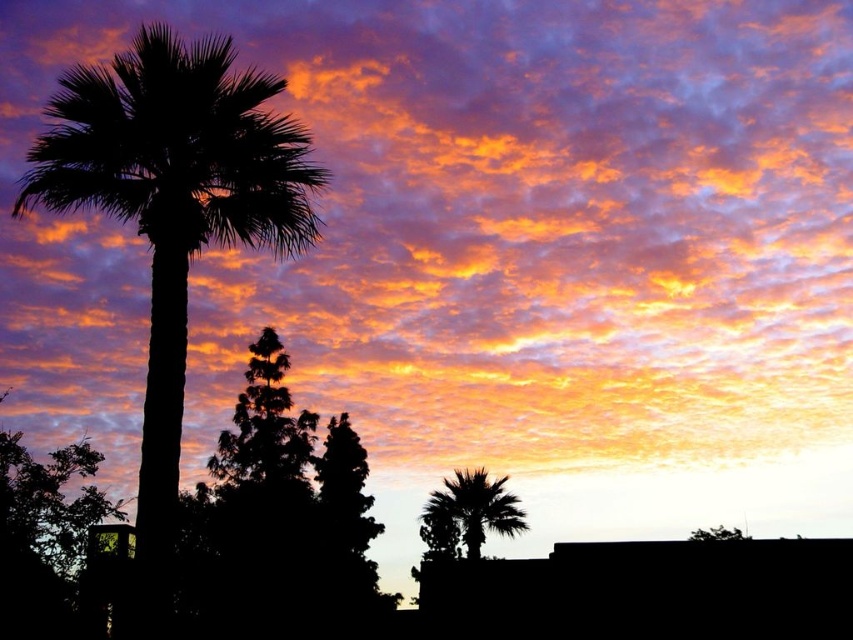
Does silhouette palm tree at left appear on the right side of silhouette palm tree at lower right?

Incorrect, silhouette palm tree at left is not on the right side of silhouette palm tree at lower right.

Which is below, silhouette palm tree at left or silhouette palm tree at lower right?

Positioned lower is silhouette palm tree at lower right.

This screenshot has width=853, height=640. What do you see at coordinates (172, 221) in the screenshot? I see `silhouette palm tree at left` at bounding box center [172, 221].

What are the coordinates of `silhouette palm tree at left` in the screenshot? It's located at (172, 221).